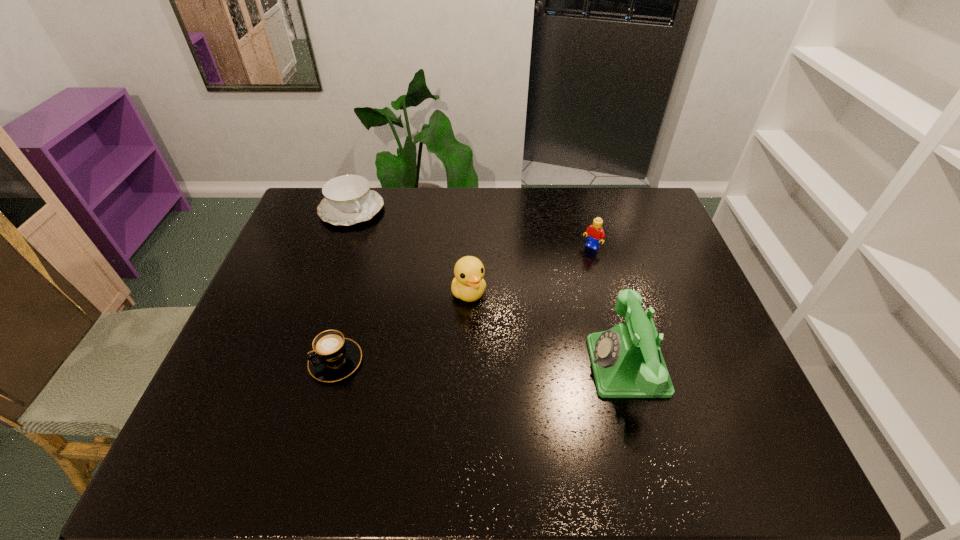
The height and width of the screenshot is (540, 960). I want to click on vacant point located between the fourth shortest object and the tallest object, so click(548, 329).

Locate an element on the screen. Image resolution: width=960 pixels, height=540 pixels. free space that is in between the farthest object and the third shortest object is located at coordinates (471, 228).

This screenshot has width=960, height=540. Find the location of `free space between the Lego and the telephone`. free space between the Lego and the telephone is located at coordinates (610, 307).

I want to click on free space between the Lego and the cappuccino, so coord(463,305).

You are a GUI agent. You are given a task and a screenshot of the screen. Output one action in this format:
    pyautogui.click(x=<x>, y=<y>)
    Task: Click on the free space between the cappuccino and the third object from right to left
    This screenshot has height=540, width=960.
    Given the screenshot: What is the action you would take?
    pyautogui.click(x=402, y=327)

You are a GUI agent. You are given a task and a screenshot of the screen. Output one action in this format:
    pyautogui.click(x=<x>, y=<y>)
    Task: Click on the vacant area that lies between the cappuccino and the third farthest object
    This screenshot has height=540, width=960.
    Given the screenshot: What is the action you would take?
    pyautogui.click(x=402, y=327)

Where is `free space between the third object from right to left and the cappuccino`? This screenshot has width=960, height=540. free space between the third object from right to left and the cappuccino is located at coordinates (402, 327).

Locate an element on the screen. free space between the farthest object and the fourth nearest object is located at coordinates (471, 228).

Image resolution: width=960 pixels, height=540 pixels. I want to click on free space between the second tallest object and the cappuccino, so click(402, 327).

Locate an element on the screen. object that is the second closest one to the cappuccino is located at coordinates click(347, 200).